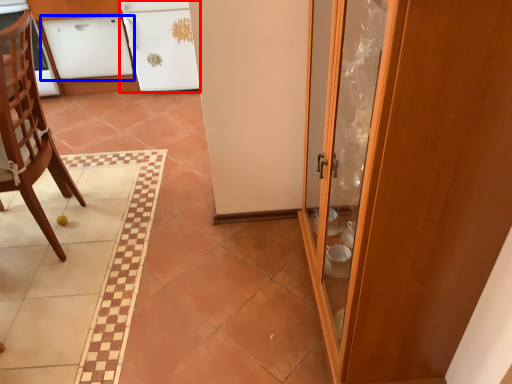
Question: Which object is further to the camera taking this photo, cabinetry (highlighted by a red box) or cabinetry (highlighted by a blue box)?

Choices:
 (A) cabinetry
 (B) cabinetry

Answer: (B)